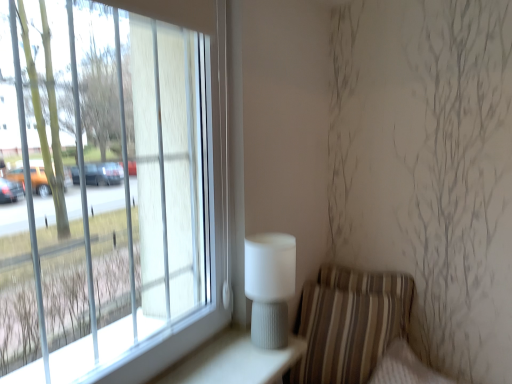
Question: Is striped fabric armchair at lower right far away from white ribbed table lamp at right?

Choices:
 (A) yes
 (B) no

Answer: (B)

Question: Is white ribbed table lamp at right surrounded by striped fabric armchair at lower right?

Choices:
 (A) no
 (B) yes

Answer: (A)

Question: Is striped fabric armchair at lower right not inside white ribbed table lamp at right?

Choices:
 (A) no
 (B) yes

Answer: (B)

Question: Is striped fabric armchair at lower right positioned with its back to white ribbed table lamp at right?

Choices:
 (A) no
 (B) yes

Answer: (A)

Question: Is the depth of striped fabric armchair at lower right less than that of white ribbed table lamp at right?

Choices:
 (A) no
 (B) yes

Answer: (A)

Question: Are striped fabric armchair at lower right and white ribbed table lamp at right beside each other?

Choices:
 (A) no
 (B) yes

Answer: (A)

Question: From a real-world perspective, is white ribbed table lamp at right located higher than striped fabric armchair at lower right?

Choices:
 (A) yes
 (B) no

Answer: (A)

Question: Would you say striped fabric armchair at lower right is part of white ribbed table lamp at right's contents?

Choices:
 (A) no
 (B) yes

Answer: (A)

Question: Can you confirm if white ribbed table lamp at right is wider than striped fabric armchair at lower right?

Choices:
 (A) yes
 (B) no

Answer: (B)

Question: Is white ribbed table lamp at right beside striped fabric armchair at lower right?

Choices:
 (A) yes
 (B) no

Answer: (B)

Question: Is white ribbed table lamp at right positioned with its back to striped fabric armchair at lower right?

Choices:
 (A) no
 (B) yes

Answer: (A)

Question: Is white ribbed table lamp at right taller than striped fabric armchair at lower right?

Choices:
 (A) yes
 (B) no

Answer: (B)

Question: Is striped fabric armchair at lower right in front of or behind white ribbed table lamp at right in the image?

Choices:
 (A) front
 (B) behind

Answer: (B)